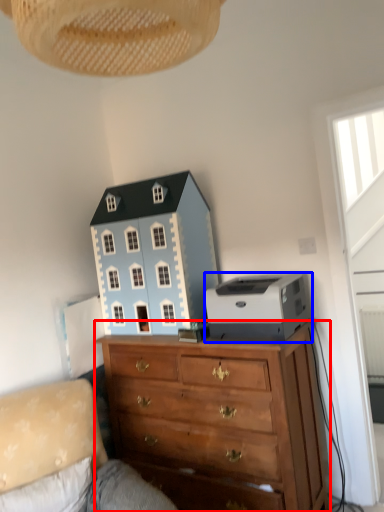
Question: Among these objects, which one is farthest to the camera, chest of drawers (highlighted by a red box) or printer (highlighted by a blue box)?

Choices:
 (A) chest of drawers
 (B) printer

Answer: (B)